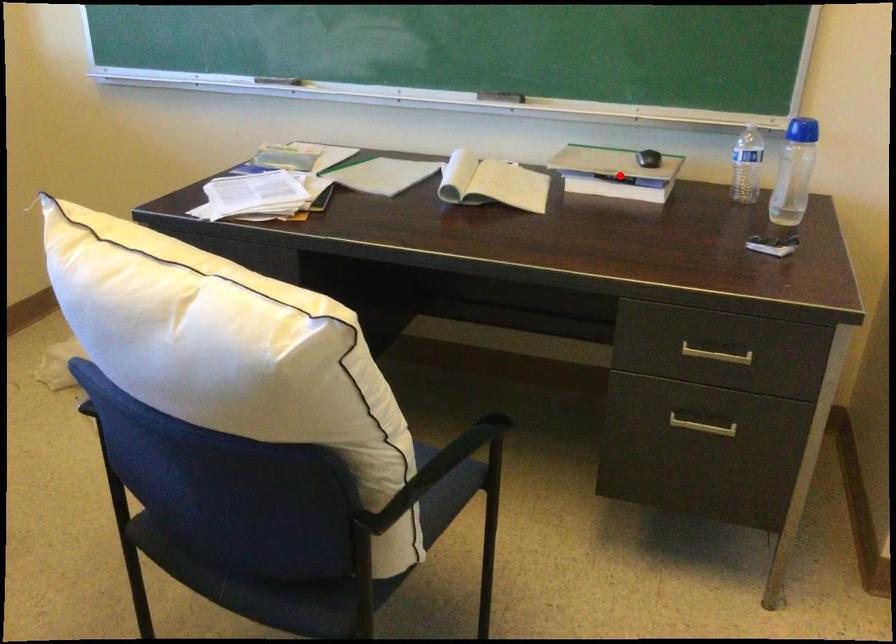
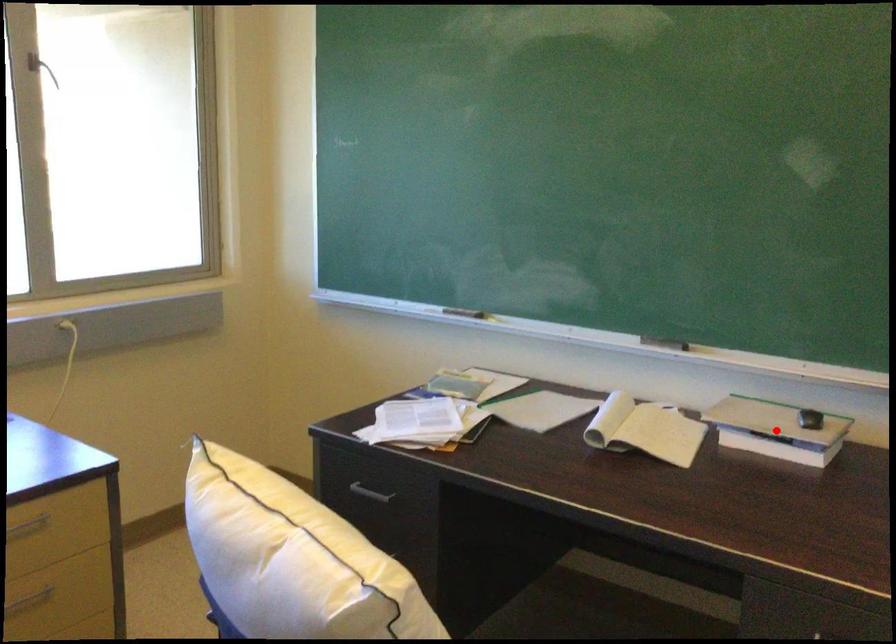
I am providing you with two images of the same scene from different viewpoints. A red point is marked on the first image and another point is marked on the second image. Are the points marked in image1 and image2 representing the same 3D position?

Yes